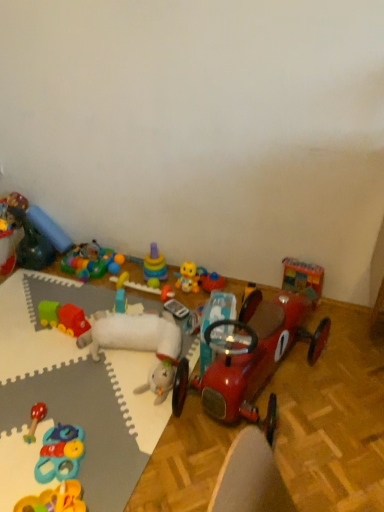
Question: Is yellow rubber duck at center, which ranks as the tenth toy in left-to-right order, inside or outside of blue fabric pillow at upper left, the tenth toy positioned from the right?

Choices:
 (A) inside
 (B) outside

Answer: (B)

Question: Considering the positions of yellow rubber duck at center, which ranks as the tenth toy in left-to-right order, and blue fabric pillow at upper left, positioned as the 3th toy in left-to-right order, in the image, is yellow rubber duck at center, which ranks as the tenth toy in left-to-right order, taller or shorter than blue fabric pillow at upper left, positioned as the 3th toy in left-to-right order,?

Choices:
 (A) tall
 (B) short

Answer: (B)

Question: Estimate the real-world distances between objects in this image. Which object is farther from the wooden toy car at upper right, the twelfth toy when ordered from left to right?

Choices:
 (A) rubber duck at upper left, the second toy when ordered from left to right
 (B) shiny red car at center, acting as the 2th toy starting from the right
 (C) yellow rubber duck at center, which ranks as the tenth toy in left-to-right order
 (D) wooden rattle at lower left, the seventh toy viewed from the right
 (E) white foam mat at lower left

Answer: (A)

Question: Which object is the closest to the rubberized plastic rings at center, the 9th toy viewed from the left?

Choices:
 (A) yellow rubber duck at center, which ranks as the tenth toy in left-to-right order
 (B) rubberized plastic toy at lower left, marked as the sixth toy in a right-to-left arrangement
 (C) rubber duck at upper left, the 11th toy from the right
 (D) rubber green and red train at lower left, positioned as the ninth toy in right-to-left order
 (E) wooden toy car at upper right, the twelfth toy when ordered from left to right

Answer: (A)